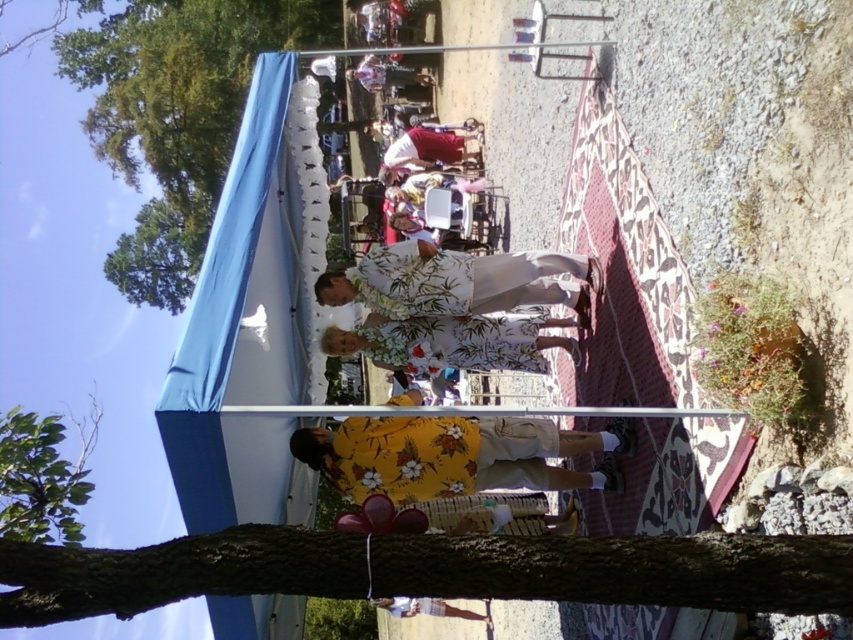
Question: Among these objects, which one is farthest from the camera?

Choices:
 (A) green leafy tree at upper left
 (B) white floral dress at center

Answer: (A)

Question: Which object appears farthest from the camera in this image?

Choices:
 (A) matte red robe at center
 (B) green leafy tree at upper left

Answer: (B)

Question: Is yellow floral fabric at center smaller than floral fabric robe at center?

Choices:
 (A) no
 (B) yes

Answer: (A)

Question: Does floral fabric robe at center appear on the right side of matte red robe at center?

Choices:
 (A) no
 (B) yes

Answer: (B)

Question: Which point appears farthest from the camera in this image?

Choices:
 (A) (134, 557)
 (B) (399, 268)
 (C) (27, 524)

Answer: (C)

Question: Does green leafy tree at upper left have a greater width compared to green leafy tree at lower left?

Choices:
 (A) no
 (B) yes

Answer: (A)